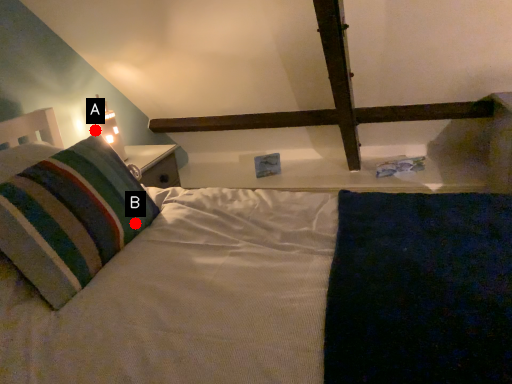
Question: Two points are circled on the image, labeled by A and B beside each circle. Among these points, which one is nearest to the camera?

Choices:
 (A) A is closer
 (B) B is closer

Answer: (B)